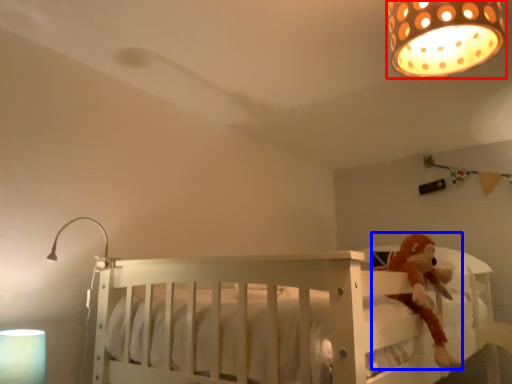
Question: Among these objects, which one is farthest to the camera, lamp (highlighted by a red box) or toy (highlighted by a blue box)?

Choices:
 (A) lamp
 (B) toy

Answer: (B)